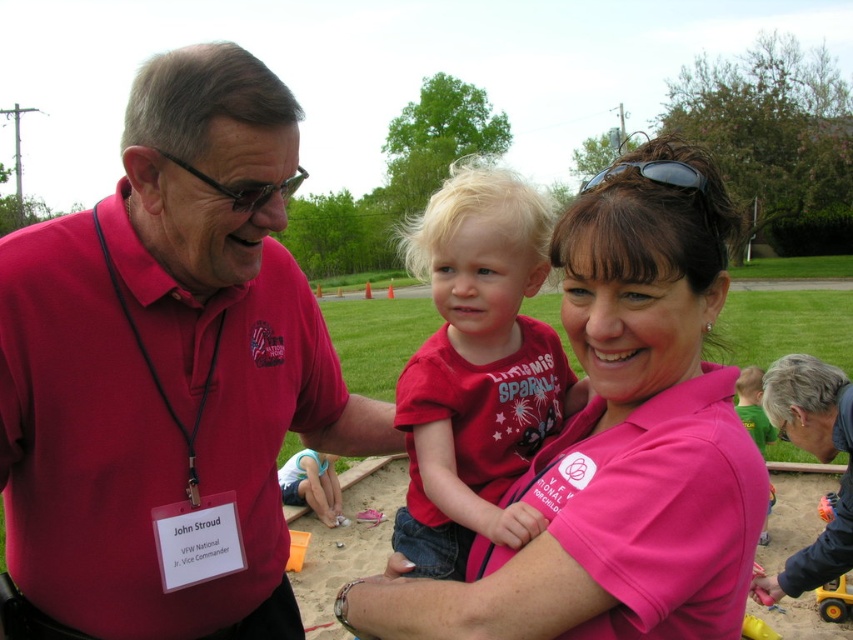
Is pink cotton shirt at center closer to camera compared to matte red shirt at center?

Yes, pink cotton shirt at center is in front of matte red shirt at center.

Which is more to the right, pink cotton shirt at center or matte red shirt at center?

pink cotton shirt at center is more to the right.

Identify the location of pink cotton shirt at center. (618, 448).

Locate an element on the screen. The width and height of the screenshot is (853, 640). pink cotton shirt at center is located at coordinates (618, 448).

Between point (292, 353) and point (498, 312), which one is positioned behind?

The point (292, 353) is behind.

The height and width of the screenshot is (640, 853). What do you see at coordinates (167, 362) in the screenshot?
I see `matte red shirt at left` at bounding box center [167, 362].

You are a GUI agent. You are given a task and a screenshot of the screen. Output one action in this format:
    pyautogui.click(x=<x>, y=<y>)
    Task: Click on the matte red shirt at left
    This screenshot has width=853, height=640.
    Given the screenshot: What is the action you would take?
    pyautogui.click(x=167, y=362)

Can you confirm if matte red shirt at center is wider than sunglasses at center?

Yes, matte red shirt at center is wider than sunglasses at center.

Between matte red shirt at center and sunglasses at center, which one has less height?

sunglasses at center is shorter.

Is point (508, 202) farther from viewer compared to point (666, 177)?

Yes, it is behind point (666, 177).

Find the location of `matte red shirt at center`. matte red shirt at center is located at coordinates (477, 371).